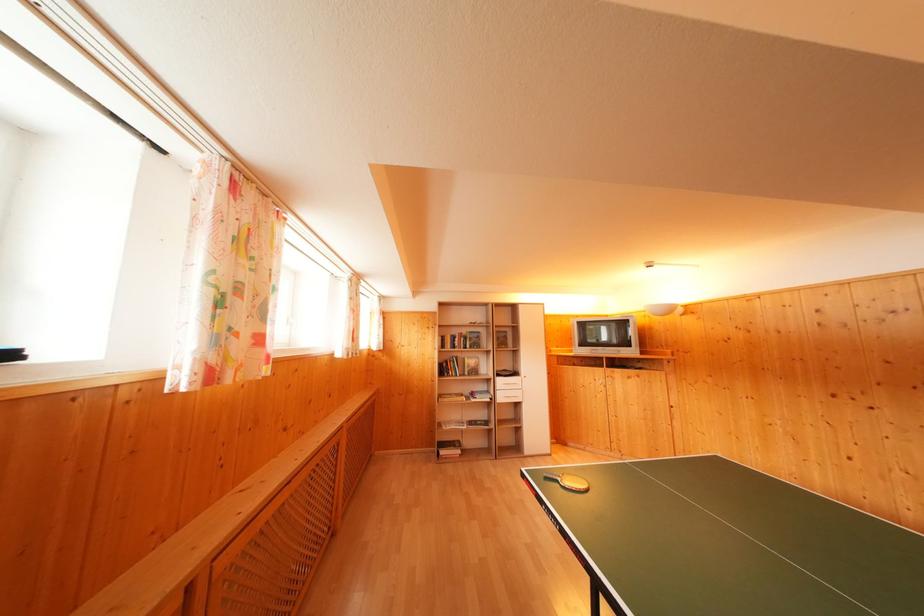
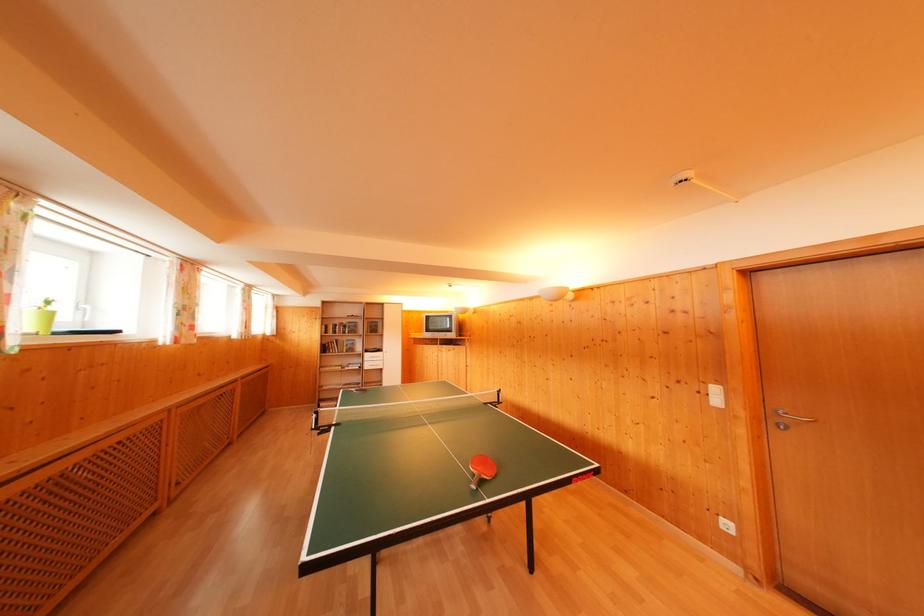
Where in the second image is the point corresponding to [447,345] from the first image?

(331, 333)